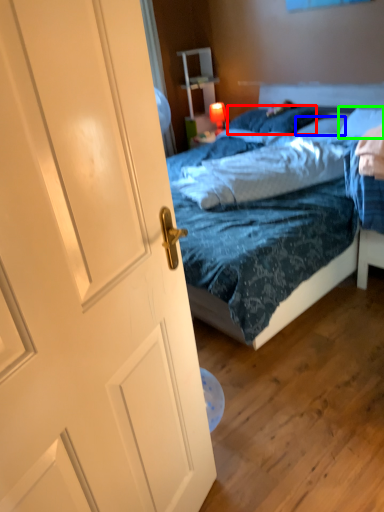
Question: Which object is positioned closest to pillow (highlighted by a red box)? Select from pillow (highlighted by a blue box) and pillow (highlighted by a green box).

Choices:
 (A) pillow
 (B) pillow

Answer: (A)